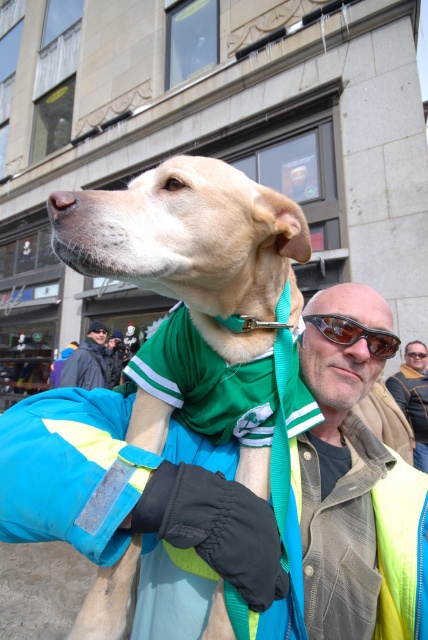
Does leather jacket at center lie behind sunglasses at center?

That is False.

Which is behind, point (410, 388) or point (424, 355)?

The point (410, 388) is more distant.

Is point (416, 426) in front of point (425, 353)?

No, (416, 426) is further to viewer.

Identify the location of leather jacket at center. (413, 403).

Does sunglasses at center have a greater height compared to sunglasses at upper center?

No, sunglasses at center is not taller than sunglasses at upper center.

Which is more to the left, sunglasses at center or sunglasses at upper center?

sunglasses at upper center

Find the location of a particular element. The image size is (428, 640). sunglasses at center is located at coordinates (416, 355).

Can you confirm if shiny black sunglasses at center is thinner than green fabric at center?

No, shiny black sunglasses at center is not thinner than green fabric at center.

Is point (386, 344) behind point (324, 412)?

No, (386, 344) is closer to viewer.

Where is `shiny black sunglasses at center`? shiny black sunglasses at center is located at coordinates (353, 333).